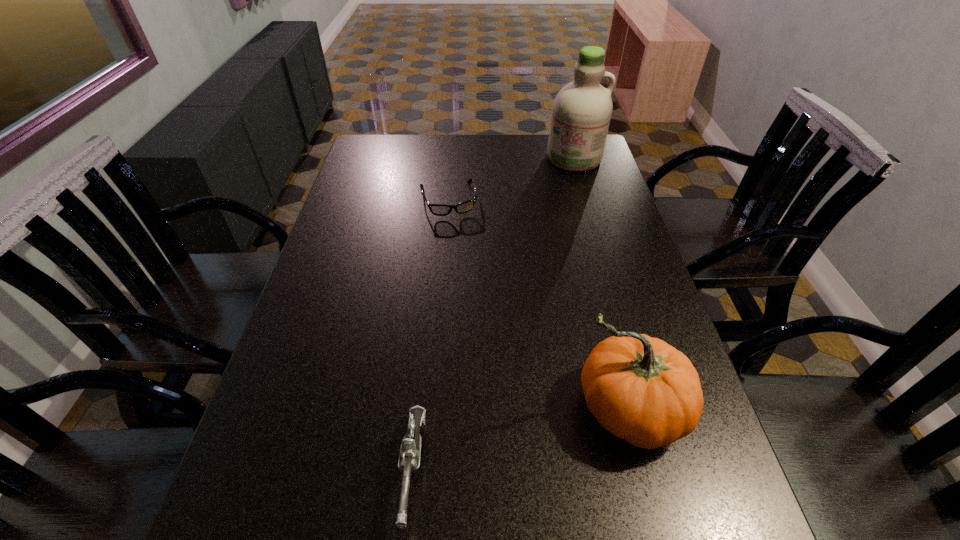
You are a GUI agent. You are given a task and a screenshot of the screen. Output one action in this format:
    pyautogui.click(x=<x>, y=<y>)
    Task: Click on the vacant space at the far edge of the desktop
    The image size is (960, 540).
    Given the screenshot: What is the action you would take?
    pyautogui.click(x=407, y=145)

You are a GUI agent. You are given a task and a screenshot of the screen. Output one action in this format:
    pyautogui.click(x=<x>, y=<y>)
    Task: Click on the vacant space at the near edge
    This screenshot has height=540, width=960.
    Given the screenshot: What is the action you would take?
    pyautogui.click(x=562, y=487)

In the image, there is a desktop. Where is `free region at the left edge`? free region at the left edge is located at coordinates (348, 308).

Locate an element on the screen. The image size is (960, 540). vacant space at the right edge is located at coordinates (593, 233).

In the image, there is a desktop. Where is `vacant space at the far left corner`? vacant space at the far left corner is located at coordinates (399, 156).

In the image, there is a desktop. Where is `vacant space at the near left corner`? Image resolution: width=960 pixels, height=540 pixels. vacant space at the near left corner is located at coordinates (320, 491).

You are a GUI agent. You are given a task and a screenshot of the screen. Output one action in this format:
    pyautogui.click(x=<x>, y=<y>)
    Task: Click on the vacant area between the shortest object and the farthest object
    
    Given the screenshot: What is the action you would take?
    [x=511, y=179]

In order to click on vacant space that is in between the gun and the third shortest object in this screenshot , I will do `click(519, 439)`.

Find the location of `free area in between the spectacles and the tallest object`. free area in between the spectacles and the tallest object is located at coordinates (511, 179).

This screenshot has width=960, height=540. What are the coordinates of `free spot between the third tallest object and the second farthest object` in the screenshot? It's located at (431, 334).